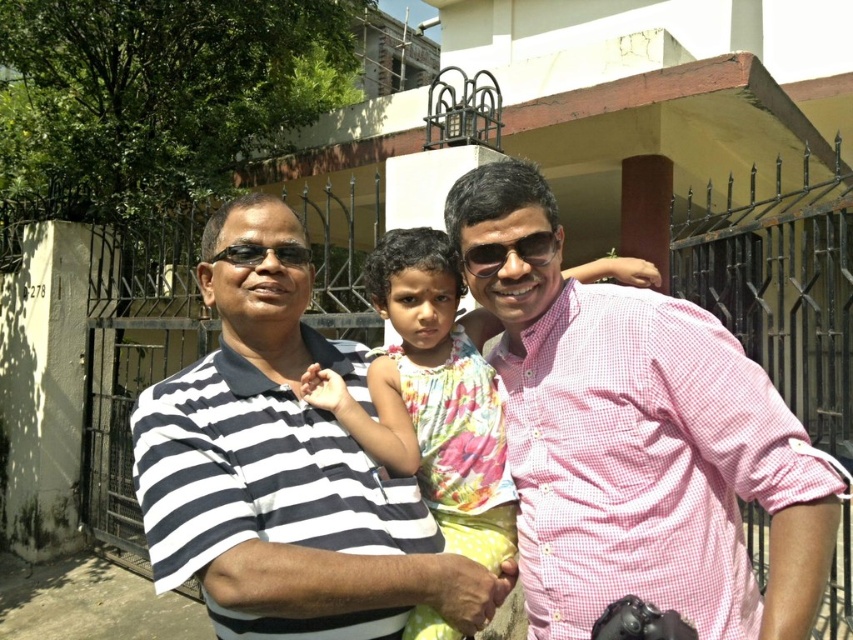
Question: Is striped cotton shirt at center positioned at the back of floral fabric dress at center?

Choices:
 (A) no
 (B) yes

Answer: (A)

Question: Which object is closer to the camera taking this photo?

Choices:
 (A) pink checkered shirt at center
 (B) black plastic goggles at left

Answer: (A)

Question: Does floral fabric dress at center appear on the right side of black plastic sunglasses at center?

Choices:
 (A) no
 (B) yes

Answer: (A)

Question: Which point is closer to the camera?

Choices:
 (A) (451, 221)
 (B) (234, 387)

Answer: (B)

Question: From the image, what is the correct spatial relationship of pink checkered shirt at center in relation to black plastic goggles at left?

Choices:
 (A) right
 (B) left

Answer: (A)

Question: Which of these objects is positioned closest to the black plastic goggles at left?

Choices:
 (A) pink checkered shirt at center
 (B) floral fabric dress at center

Answer: (B)